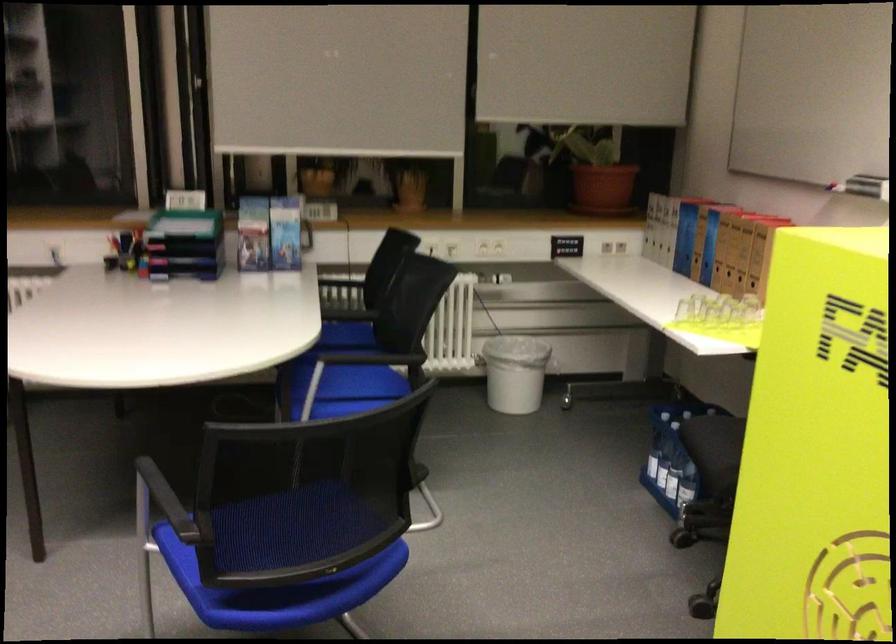
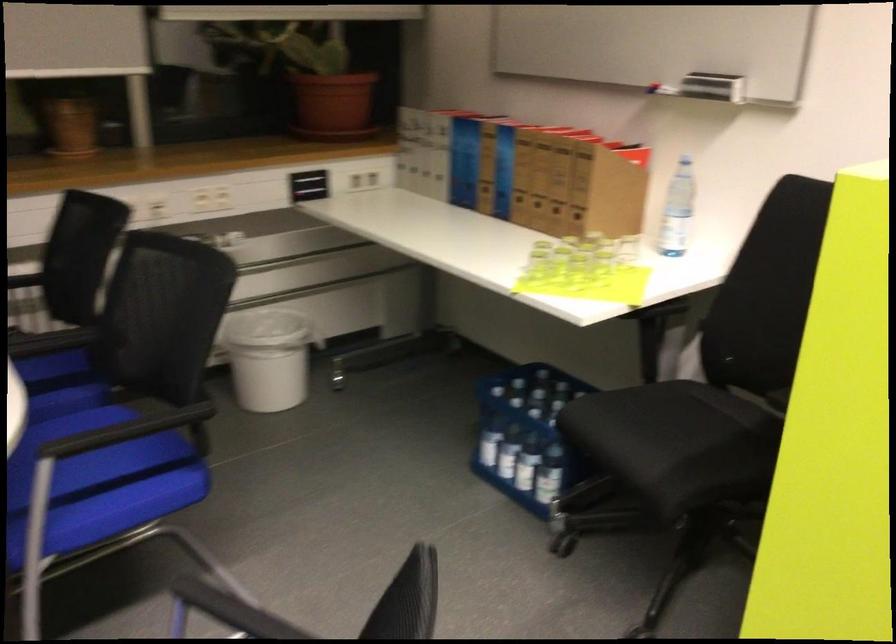
Question: The camera is either moving clockwise (left) or counter-clockwise (right) around the object. The first image is from the beginning of the video and the second image is from the end. Is the camera moving left or right when shooting the video?

Choices:
 (A) Left
 (B) Right

Answer: (A)